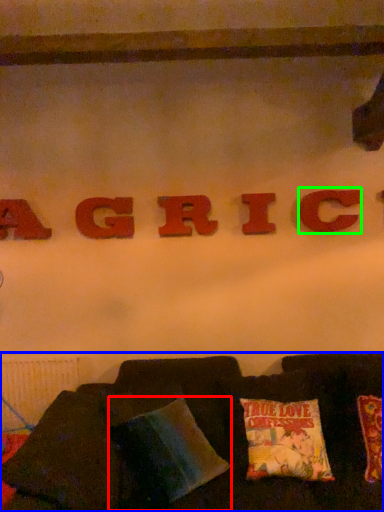
Question: Based on their relative distances, which object is nearer to pillow (highlighted by a red box)? Choose from furniture (highlighted by a blue box) and letter (highlighted by a green box).

Choices:
 (A) furniture
 (B) letter

Answer: (A)